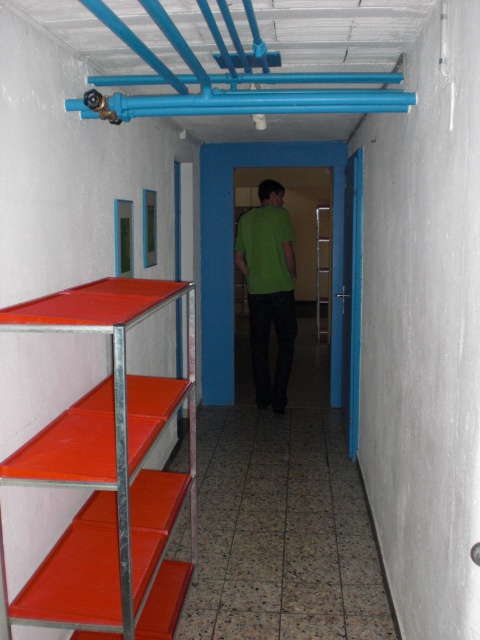
You are standing in the corridor and want to determine which of the two points, point (260,218) or point (323,323), is closer to you. Based on the scene description, which point is nearer?

Point (260,218) is closer to the camera than point (323,323), so it is the nearer point.

You are a delivery person holding a package that is 1.6 meters long. You need to move it through the corridor shown in the image. Is the metallic red shelf at left close enough to the camera for you to safely pass the package under it?

The metallic red shelf at left is 1.59 meters from the camera. Since the package is 1.6 meters long, it is slightly longer than the distance available, so you cannot safely pass the package under the metallic red shelf at left.